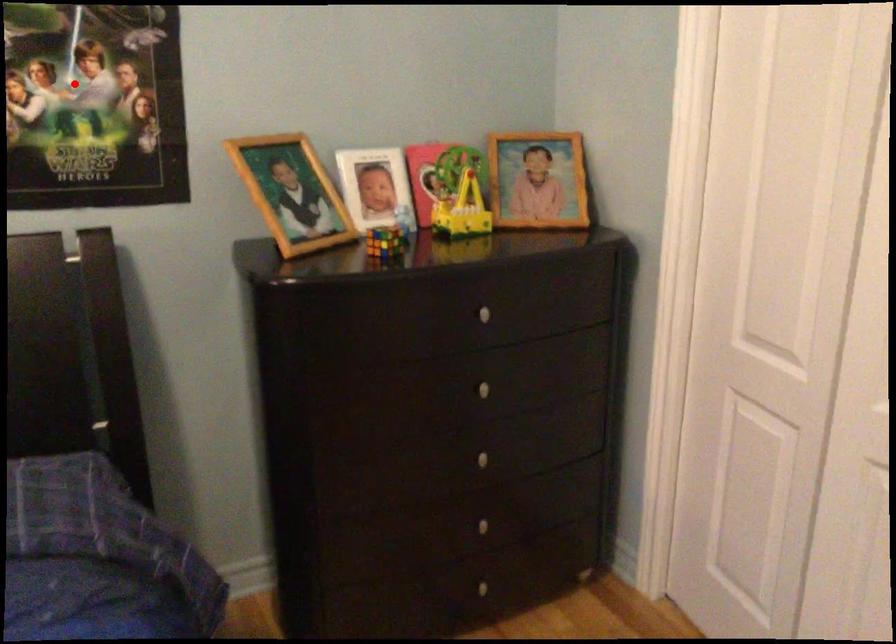
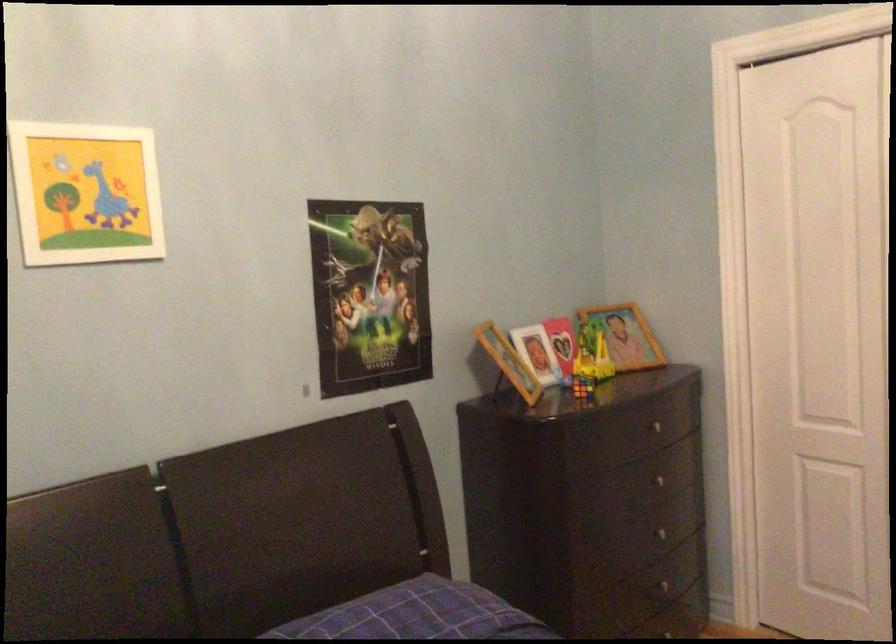
Question: I am providing you with two images of the same scene from different viewpoints. Given a red point in image1, look at the same physical point in image2. Is it:

Choices:
 (A) Closer to the viewpoint
 (B) Farther from the viewpoint

Answer: (B)